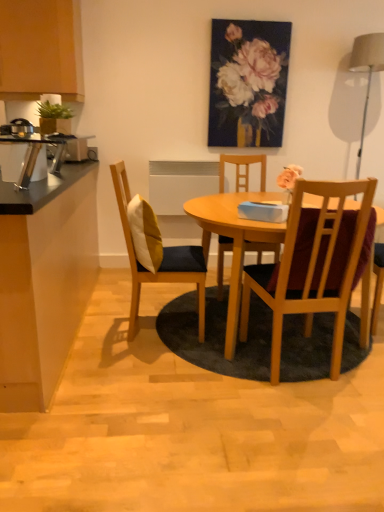
Question: From their relative heights in the image, would you say wooden chair at center, which is the 1th chair in right-to-left order, is taller or shorter than matte gray lampshade at upper right?

Choices:
 (A) tall
 (B) short

Answer: (B)

Question: Would you say wooden chair at center, the third chair viewed from the left, is to the left or to the right of matte gray lampshade at upper right in the picture?

Choices:
 (A) left
 (B) right

Answer: (A)

Question: Which is nearer to the matte gray lampshade at upper right?

Choices:
 (A) metallic silver toaster at left, which is the 1th appliance in right-to-left order
 (B) matte wood cabinet at upper left
 (C) wooden chair at center, which is counted as the second chair, starting from the right
 (D) brushed metal toaster at left, the 2th appliance from the bottom
 (E) pastel floral painting at upper center

Answer: (E)

Question: Considering the real-world distances, which object is closest to the wooden chair at center, the 2th chair when ordered from left to right?

Choices:
 (A) pastel floral painting at upper center
 (B) wooden chair with cushion at center, which is counted as the first chair, starting from the left
 (C) matte wood cabinet at upper left
 (D) black laminate countertop at left
 (E) brushed metal toaster at left, placed as the 1th appliance when sorted from top to bottom

Answer: (A)